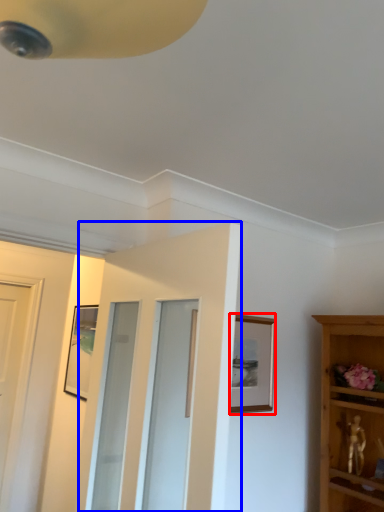
Question: Which point is further to the camera, picture frame (highlighted by a red box) or door (highlighted by a blue box)?

Choices:
 (A) picture frame
 (B) door

Answer: (A)